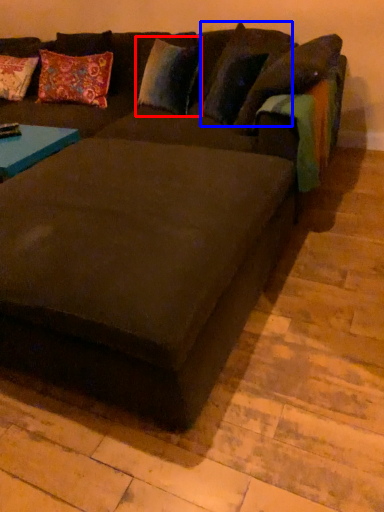
Question: Which object is closer to the camera taking this photo, pillow (highlighted by a red box) or pillow (highlighted by a blue box)?

Choices:
 (A) pillow
 (B) pillow

Answer: (B)